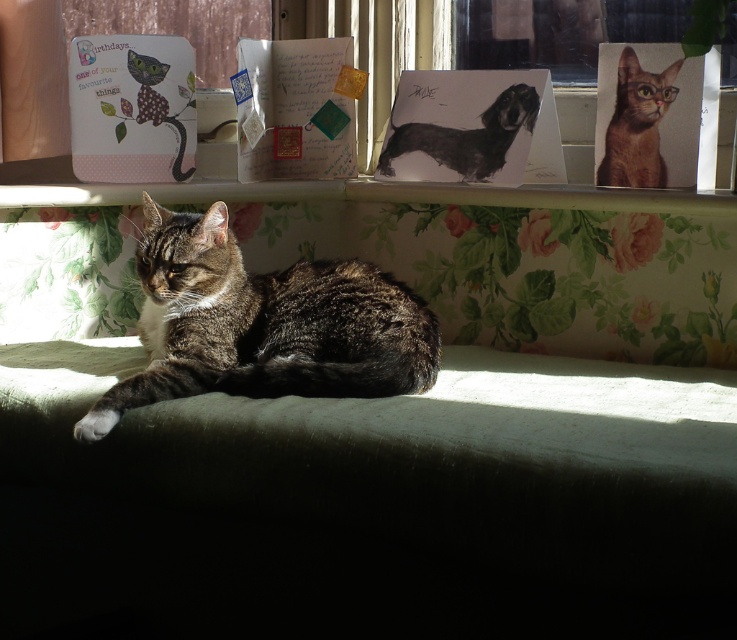
Does tabby fur cat at center have a larger size compared to white glossy paper at upper center?

Yes.

Where is `tabby fur cat at center`? This screenshot has width=737, height=640. tabby fur cat at center is located at coordinates (262, 324).

Locate an element on the screen. Image resolution: width=737 pixels, height=640 pixels. tabby fur cat at center is located at coordinates (262, 324).

Who is positioned more to the left, tabby fur cat at center or transparent glass window at upper center?

From the viewer's perspective, tabby fur cat at center appears more on the left side.

Who is shorter, tabby fur cat at center or transparent glass window at upper center?

Standing shorter between the two is transparent glass window at upper center.

Between point (373, 308) and point (558, 20), which one is positioned in front?

Point (373, 308) is more forward.

You are a GUI agent. You are given a task and a screenshot of the screen. Output one action in this format:
    pyautogui.click(x=<x>, y=<y>)
    Task: Click on the tabby fur cat at center
    
    Given the screenshot: What is the action you would take?
    pyautogui.click(x=262, y=324)

Which of these two, green fabric couch at lower center or black glossy dog at upper center, stands taller?

green fabric couch at lower center

Which is behind, point (702, 548) or point (468, 180)?

Positioned behind is point (468, 180).

At what (x,y) coordinates should I click in order to perform the action: click on green fabric couch at lower center. Please return your answer as a coordinate pair (x, y). The height and width of the screenshot is (640, 737). Looking at the image, I should click on (383, 436).